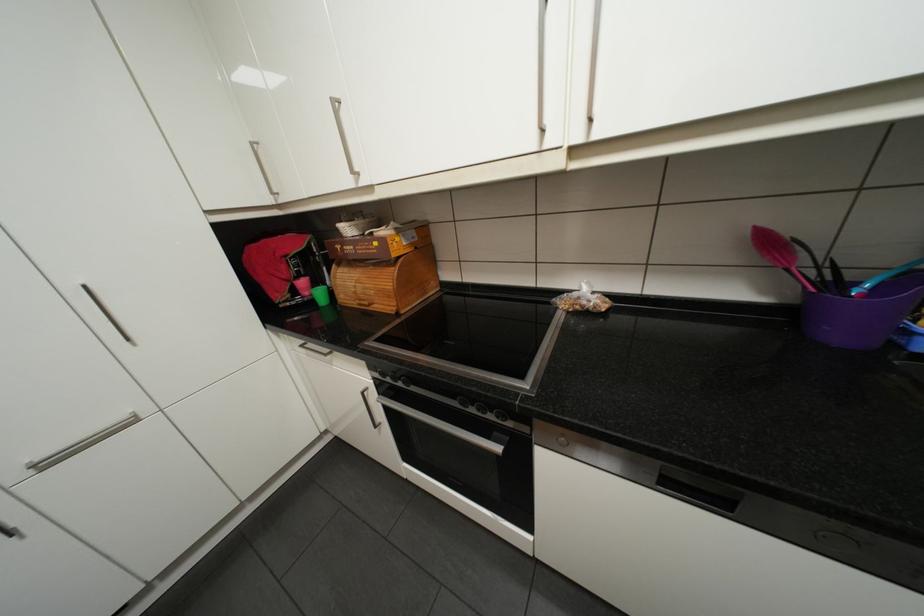
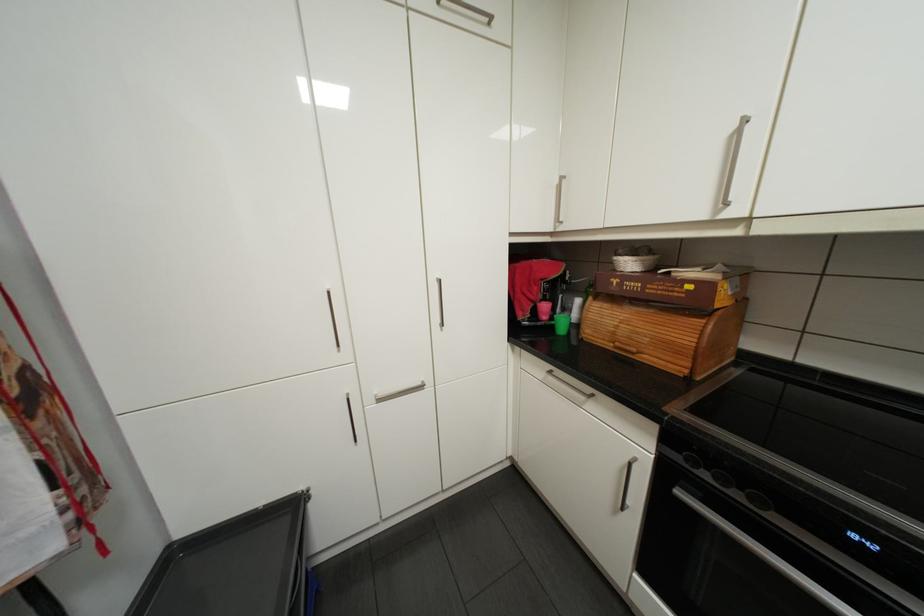
The point at [402,254] is marked in the first image. Where is the corresponding point in the second image?

(725, 305)